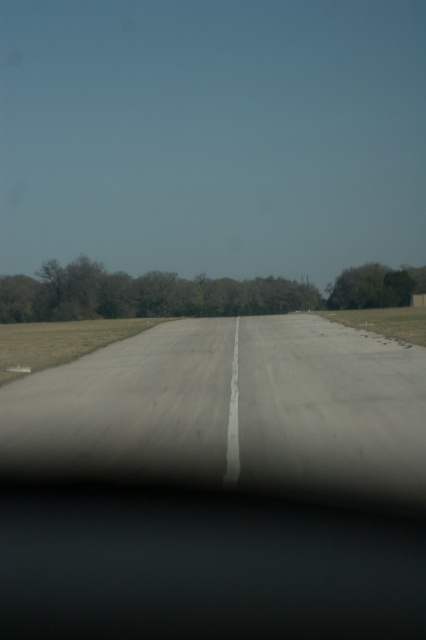
Does gray asphalt runway at center have a smaller size compared to green leafy trees at center?

Yes.

Is gray asphalt runway at center thinner than green leafy trees at center?

Indeed, gray asphalt runway at center has a lesser width compared to green leafy trees at center.

Who is more distant from viewer, (x=282, y=419) or (x=275, y=276)?

Positioned behind is point (x=275, y=276).

This screenshot has width=426, height=640. I want to click on gray asphalt runway at center, so click(230, 406).

How much distance is there between gray asphalt runway at center and green leafy tree at right?

A distance of 176.38 feet exists between gray asphalt runway at center and green leafy tree at right.

Consider the image. Does gray asphalt runway at center have a smaller size compared to green leafy tree at right?

Indeed, gray asphalt runway at center has a smaller size compared to green leafy tree at right.

Is point (58, 369) closer to camera compared to point (416, 284)?

Yes, point (58, 369) is in front of point (416, 284).

This screenshot has width=426, height=640. Find the location of `gray asphalt runway at center`. gray asphalt runway at center is located at coordinates (230, 406).

How distant is green leafy trees at center from green leafy tree at right?

They are 8.18 meters apart.

Does point (163, 305) come closer to viewer compared to point (345, 304)?

Yes.

The height and width of the screenshot is (640, 426). What are the coordinates of `green leafy trees at center` in the screenshot? It's located at (190, 292).

Find the location of `green leafy trees at center`. green leafy trees at center is located at coordinates tap(190, 292).